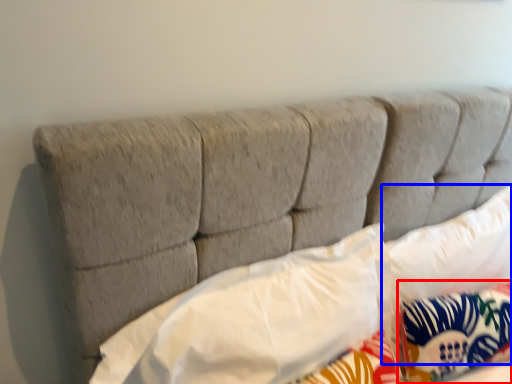
Question: Which object is further to the camera taking this photo, pillow (highlighted by a red box) or pillow (highlighted by a blue box)?

Choices:
 (A) pillow
 (B) pillow

Answer: (A)